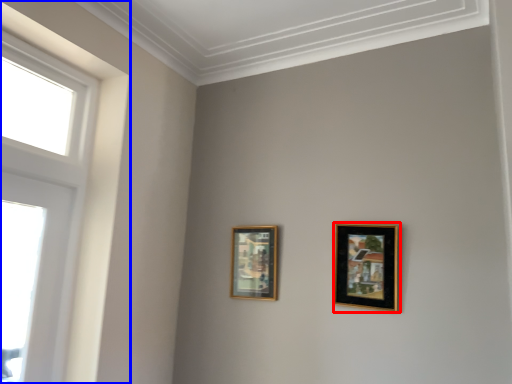
Question: Which of the following is the farthest to the observer, picture frame (highlighted by a red box) or window (highlighted by a blue box)?

Choices:
 (A) picture frame
 (B) window

Answer: (A)